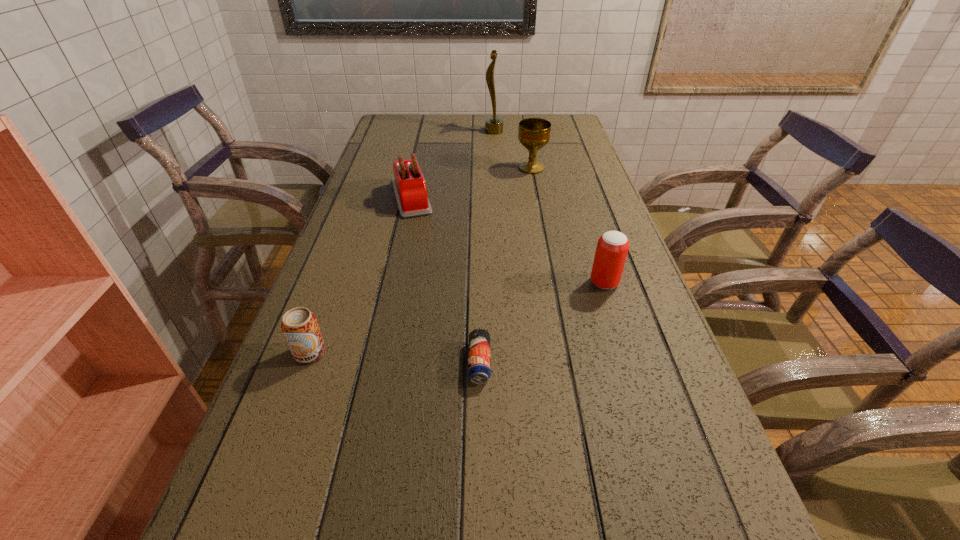
You are a GUI agent. You are given a task and a screenshot of the screen. Output one action in this format:
    pyautogui.click(x=<x>, y=<y>)
    Task: Click on the award
    This screenshot has height=540, width=960.
    Given the screenshot: What is the action you would take?
    click(494, 125)

The width and height of the screenshot is (960, 540). Find the location of `the farthest object`. the farthest object is located at coordinates (494, 125).

Where is `chalice`? This screenshot has width=960, height=540. chalice is located at coordinates 534,133.

Where is `the fifth nearest object`? the fifth nearest object is located at coordinates (534, 133).

Identify the location of the fifth object from right to left. (409, 185).

Identify the location of toaster. The image size is (960, 540). (409, 185).

Where is `the third nearest object`? Image resolution: width=960 pixels, height=540 pixels. the third nearest object is located at coordinates (612, 248).

You are a GUI agent. You are given a task and a screenshot of the screen. Output one action in this format:
    pyautogui.click(x=<x>, y=<y>)
    Task: Click on the rightmost beer can
    
    Given the screenshot: What is the action you would take?
    pyautogui.click(x=612, y=248)

Where is `the leftmost object`? Image resolution: width=960 pixels, height=540 pixels. the leftmost object is located at coordinates tap(300, 327).

This screenshot has height=540, width=960. Find the location of `the fifth tallest object`. the fifth tallest object is located at coordinates (300, 327).